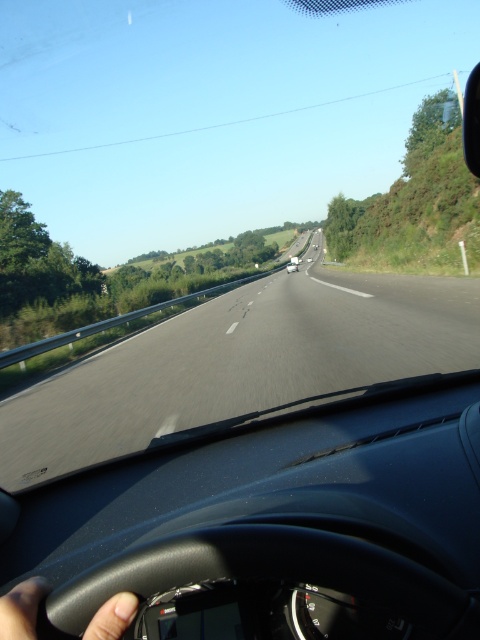
Does asphalt road at center have a greater height compared to white glossy car at center?

Yes, asphalt road at center is taller than white glossy car at center.

Between asphalt road at center and white glossy car at center, which one has less height?

white glossy car at center

Is point (384, 364) positioned in front of point (295, 266)?

Yes, it is in front of point (295, 266).

The height and width of the screenshot is (640, 480). In order to click on asphalt road at center in this screenshot , I will do `click(240, 362)`.

Between point (34, 595) and point (287, 268), which one is positioned in front?

Positioned in front is point (34, 595).

Where is `black matte steering wheel at lower left`? black matte steering wheel at lower left is located at coordinates [22, 609].

Between point (47, 584) and point (289, 268), which one is positioned behind?

Point (289, 268)

In order to click on black matte steering wheel at lower left in this screenshot , I will do `click(22, 609)`.

From the picture: How far apart are asphalt road at center and black matte steering wheel at lower left?

A distance of 31.80 feet exists between asphalt road at center and black matte steering wheel at lower left.

Does asphalt road at center have a greater width compared to black matte steering wheel at lower left?

Yes.

Between point (39, 426) and point (31, 579), which one is positioned in front?

Point (31, 579) is in front.

Image resolution: width=480 pixels, height=640 pixels. I want to click on asphalt road at center, so click(240, 362).